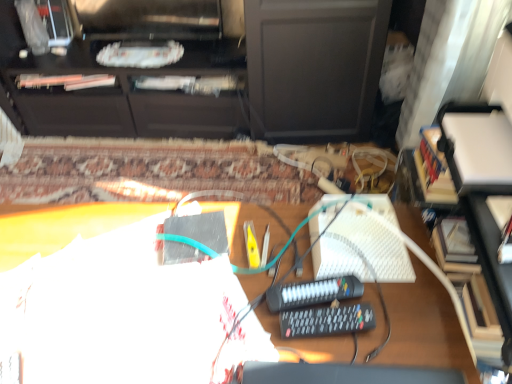
Image resolution: width=512 pixels, height=384 pixels. Find the location of `vacant region in front of white textured keyboard at center-right`. vacant region in front of white textured keyboard at center-right is located at coordinates (396, 320).